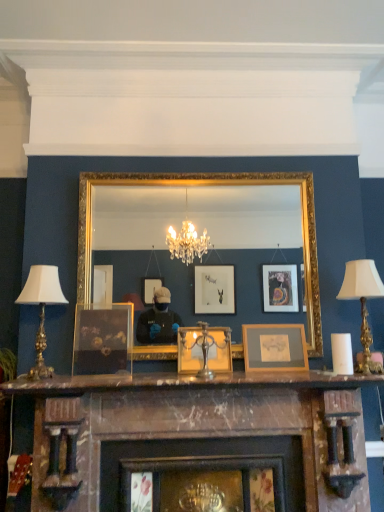
Question: From the image's perspective, is marble fireplace at center under marble mantel at center?

Choices:
 (A) yes
 (B) no

Answer: (A)

Question: Is marble fireplace at center surrounding marble mantel at center?

Choices:
 (A) yes
 (B) no

Answer: (B)

Question: Considering the relative sizes of marble fireplace at center and marble mantel at center in the image provided, is marble fireplace at center wider than marble mantel at center?

Choices:
 (A) yes
 (B) no

Answer: (A)

Question: Is the position of marble fireplace at center more distant than that of marble mantel at center?

Choices:
 (A) no
 (B) yes

Answer: (A)

Question: Considering the relative positions of marble fireplace at center and marble mantel at center in the image provided, is marble fireplace at center to the left of marble mantel at center from the viewer's perspective?

Choices:
 (A) yes
 (B) no

Answer: (A)

Question: Considering the positions of matte glass picture frame at center, acting as the 3th picture frame starting from the right, and silver metallic table lamp at left, the 2th table lamp when ordered from right to left, in the image, is matte glass picture frame at center, acting as the 3th picture frame starting from the right, taller or shorter than silver metallic table lamp at left, the 2th table lamp when ordered from right to left,?

Choices:
 (A) short
 (B) tall

Answer: (A)

Question: Do you think matte glass picture frame at center, acting as the 3th picture frame starting from the right, is within silver metallic table lamp at left, the 2th table lamp when ordered from right to left, or outside of it?

Choices:
 (A) outside
 (B) inside

Answer: (A)

Question: Relative to silver metallic table lamp at left, the 2th table lamp when ordered from right to left, is matte glass picture frame at center, arranged as the first picture frame when viewed from the left, in front or behind?

Choices:
 (A) behind
 (B) front

Answer: (A)

Question: In terms of size, does matte glass picture frame at center, arranged as the first picture frame when viewed from the left, appear bigger or smaller than silver metallic table lamp at left, the 1th table lamp positioned from the left?

Choices:
 (A) big
 (B) small

Answer: (B)

Question: Considering their positions, is wooden picture frame at center, positioned as the first picture frame in right-to-left order, located in front of or behind gold-framed mirror at center?

Choices:
 (A) behind
 (B) front

Answer: (A)

Question: Is point (294, 360) positioned closer to the camera than point (81, 287)?

Choices:
 (A) farther
 (B) closer

Answer: (B)

Question: Is wooden picture frame at center, positioned as the first picture frame in right-to-left order, situated inside gold-framed mirror at center or outside?

Choices:
 (A) outside
 (B) inside

Answer: (B)

Question: Looking at the image, does wooden picture frame at center, positioned as the first picture frame in right-to-left order, seem bigger or smaller compared to gold-framed mirror at center?

Choices:
 (A) big
 (B) small

Answer: (B)

Question: From the image's perspective, is wooden picture frame at center, positioned as the third picture frame in left-to-right order, above or below metallic gold picture frame at center, which is the second picture frame from left to right?

Choices:
 (A) above
 (B) below

Answer: (B)

Question: From their relative heights in the image, would you say wooden picture frame at center, positioned as the third picture frame in left-to-right order, is taller or shorter than metallic gold picture frame at center, which is the second picture frame from left to right?

Choices:
 (A) short
 (B) tall

Answer: (B)